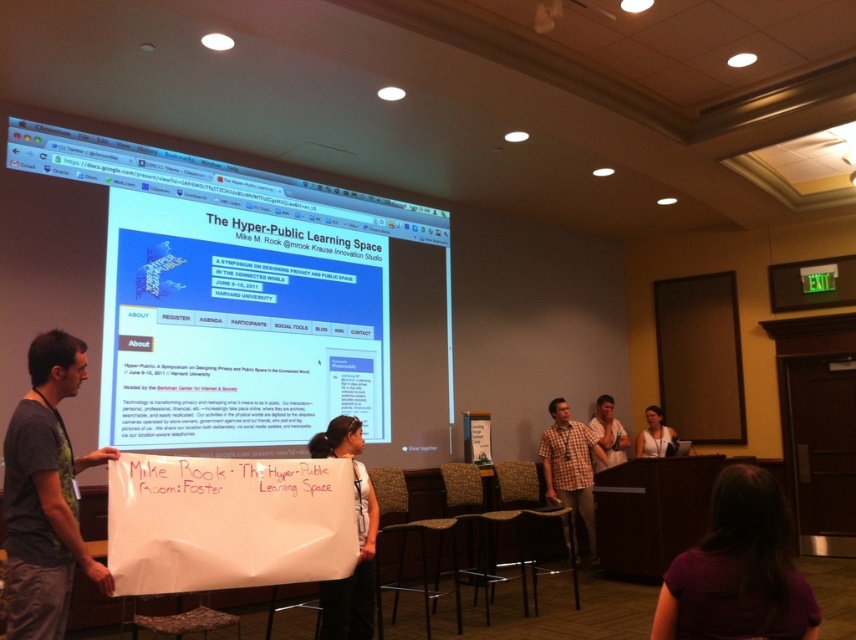
You are attending a conference and see two people in the room. One is wearing a purple fabric shirt at lower center and the other a checkered fabric shirt at center. Which person is closer to the front of the room?

The purple fabric shirt at lower center is smaller than the checkered fabric shirt at center, which indicates that the person in the purple fabric shirt at lower center is closer to the front of the room since smaller objects appear closer in such contexts.

You are an attendee in the conference room and want to move from the whiteboard to the projection screen. The whiteboard is at point (568,461) and the projection screen is at point (672,582). Which direction should you walk to reach the projection screen?

You should walk towards point (672,582), which is in front of point (568,461), to reach the projection screen.

You are organizing a conference and need to place a 3.5 feet wide table between the gray fabric banner at left and the purple fabric shirt at lower center. Can the table fit between them without overlapping?

The gray fabric banner at left and purple fabric shirt at lower center are 6.89 feet apart, so a 3.5 feet wide table can fit between them since the distance is greater than the table width.